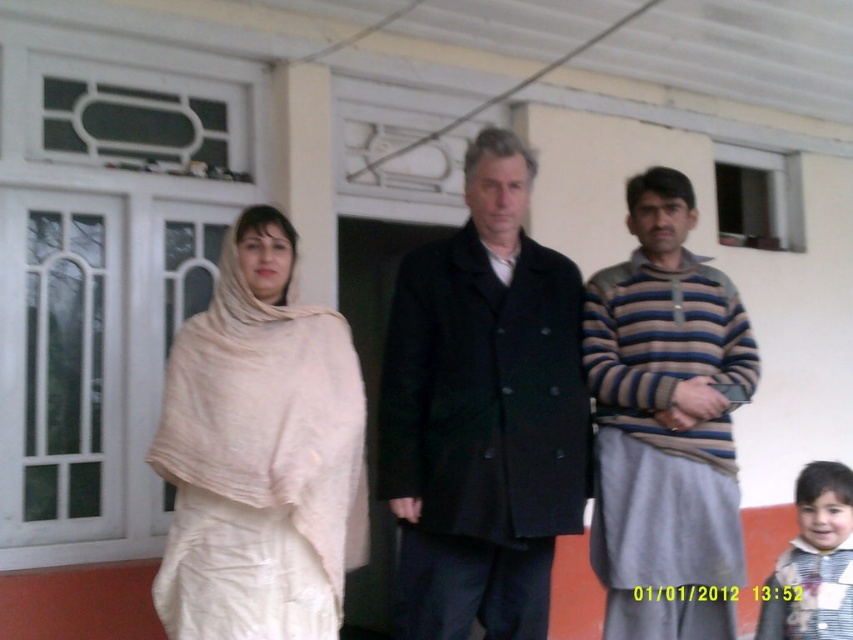
Can you confirm if light beige fabric at left is shorter than black woolen coat at center?

Yes.

Can you confirm if light beige fabric at left is bigger than black woolen coat at center?

Yes.

At what (x,y) coordinates should I click in order to perform the action: click on light beige fabric at left. Please return your answer as a coordinate pair (x, y). Looking at the image, I should click on (485, 412).

At what (x,y) coordinates should I click in order to perform the action: click on light beige fabric at left. Please return your answer as a coordinate pair (x, y). The width and height of the screenshot is (853, 640). Looking at the image, I should click on (485, 412).

Which is in front, point (309, 316) or point (827, 593)?

Point (827, 593) is more forward.

Is point (260, 572) farther from viewer compared to point (755, 637)?

No.

Looking at this image, measure the distance between beige fabric shawl at left and camera.

A distance of 8.00 feet exists between beige fabric shawl at left and camera.

At what (x,y) coordinates should I click in order to perform the action: click on beige fabric shawl at left. Please return your answer as a coordinate pair (x, y). The width and height of the screenshot is (853, 640). Looking at the image, I should click on (260, 452).

Is light beige fabric at left closer to camera compared to striped fabric shirt at lower right?

Yes, light beige fabric at left is in front of striped fabric shirt at lower right.

Does light beige fabric at left have a larger size compared to striped fabric shirt at lower right?

Yes.

Between point (242, 268) and point (798, 593), which one is positioned in front?

Point (242, 268)

Locate an element on the screen. light beige fabric at left is located at coordinates (485, 412).